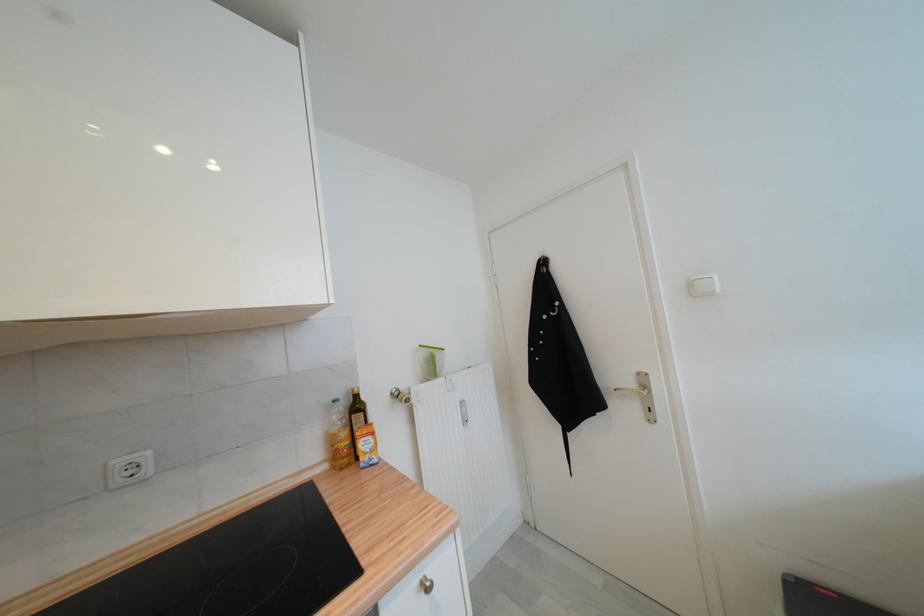
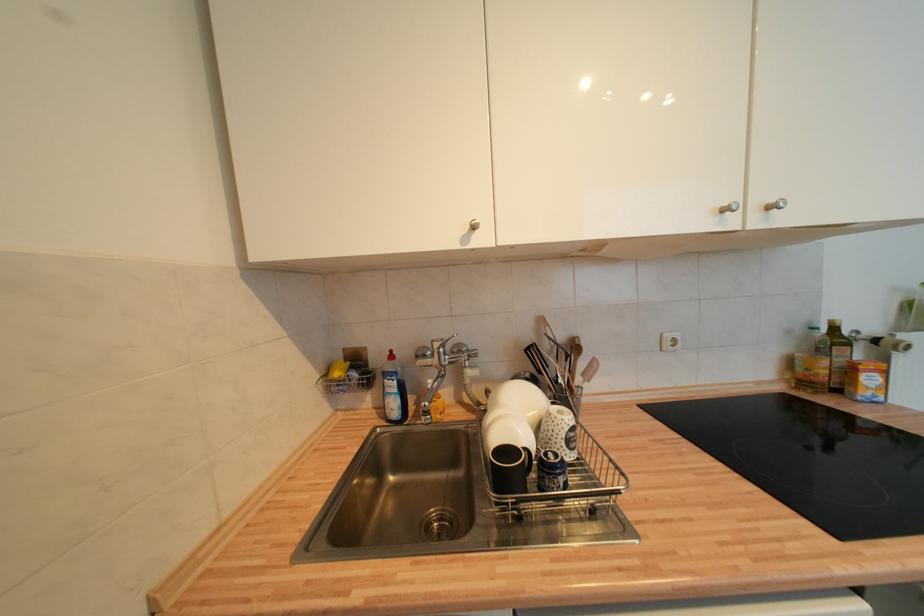
Where in the second image is the point corresponding to [371,456] from the first image?

(873, 391)